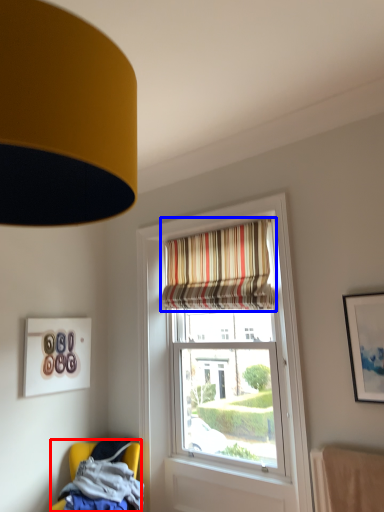
Question: Among these objects, which one is farthest to the camera, chair (highlighted by a red box) or curtain (highlighted by a blue box)?

Choices:
 (A) chair
 (B) curtain

Answer: (B)